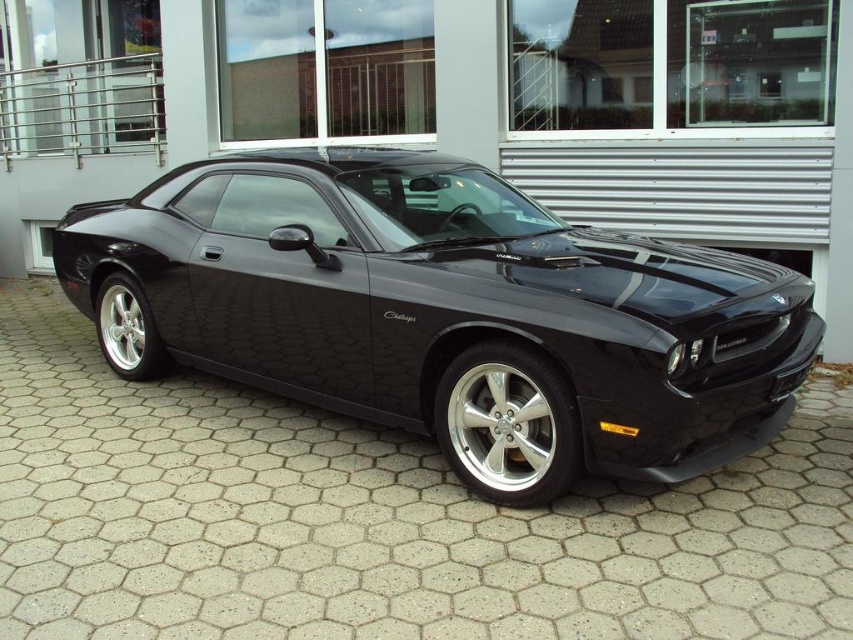
Between black asphalt driveway at center and glossy black car at center, which one has more height?

glossy black car at center is taller.

Between point (117, 465) and point (521, 321), which one is positioned in front?

Point (521, 321) is in front.

Find the location of `black asphalt driveway at center`. black asphalt driveway at center is located at coordinates (376, 518).